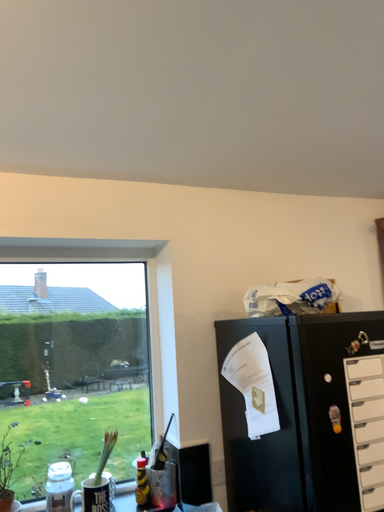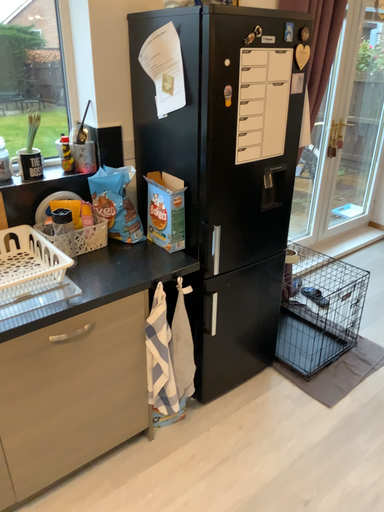
Question: Which way did the camera rotate in the video?

Choices:
 (A) rotated left
 (B) rotated right

Answer: (B)